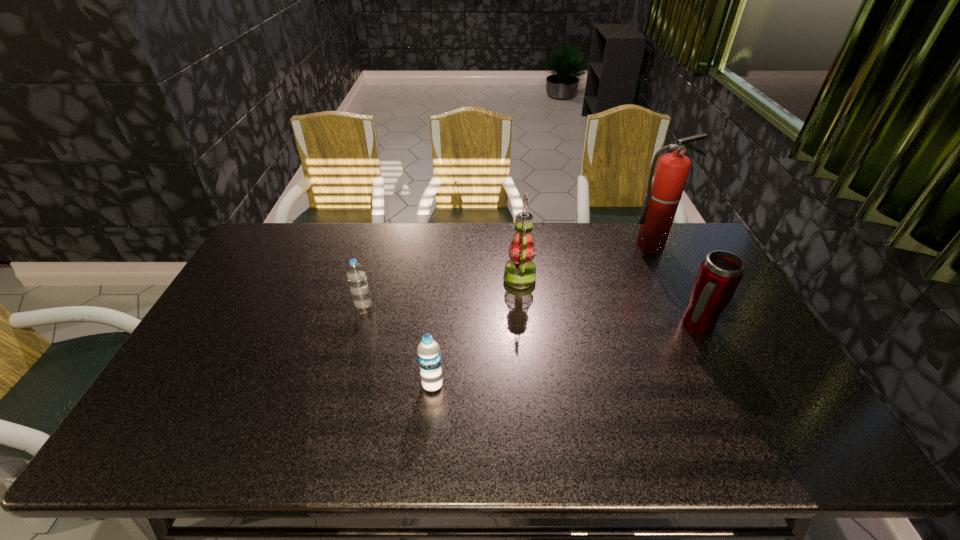
The width and height of the screenshot is (960, 540). I want to click on free space located on the right of the second farthest object, so click(x=583, y=278).

The width and height of the screenshot is (960, 540). I want to click on free region located on the side with the handle of the thermos bottle, so click(711, 355).

Where is `vacant region located 0.260m on the back of the left water bottle`? vacant region located 0.260m on the back of the left water bottle is located at coordinates (380, 252).

Locate an element on the screen. The image size is (960, 540). free spot located on the label of the second object from left to right is located at coordinates pos(427,440).

This screenshot has width=960, height=540. I want to click on object at the far edge, so click(663, 196).

Where is `fire extinguisher that is at the right edge`? The image size is (960, 540). fire extinguisher that is at the right edge is located at coordinates (663, 196).

Where is `thermos bottle that is positioned at the right edge`? thermos bottle that is positioned at the right edge is located at coordinates (719, 275).

Where is `object at the far right corner`? object at the far right corner is located at coordinates (663, 196).

At what (x,y) coordinates should I click in order to perform the action: click on free space at the far edge of the desktop. Please return your answer as a coordinate pair (x, y). Looking at the image, I should click on (476, 256).

Identify the location of vacant space at the near edge. (293, 437).